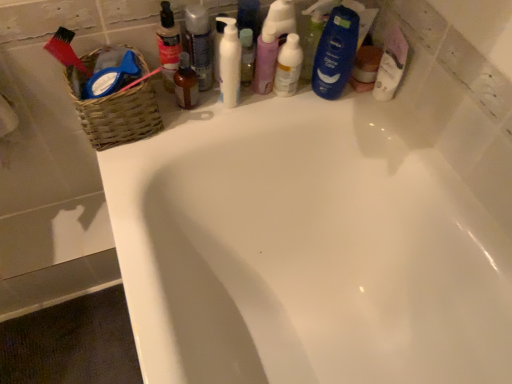
You are a GUI agent. You are given a task and a screenshot of the screen. Output one action in this format:
    pyautogui.click(x=<x>, y=<y>)
    Task: Click on the free location in front of white glossy bottle at upper center
    
    Given the screenshot: What is the action you would take?
    tap(268, 107)